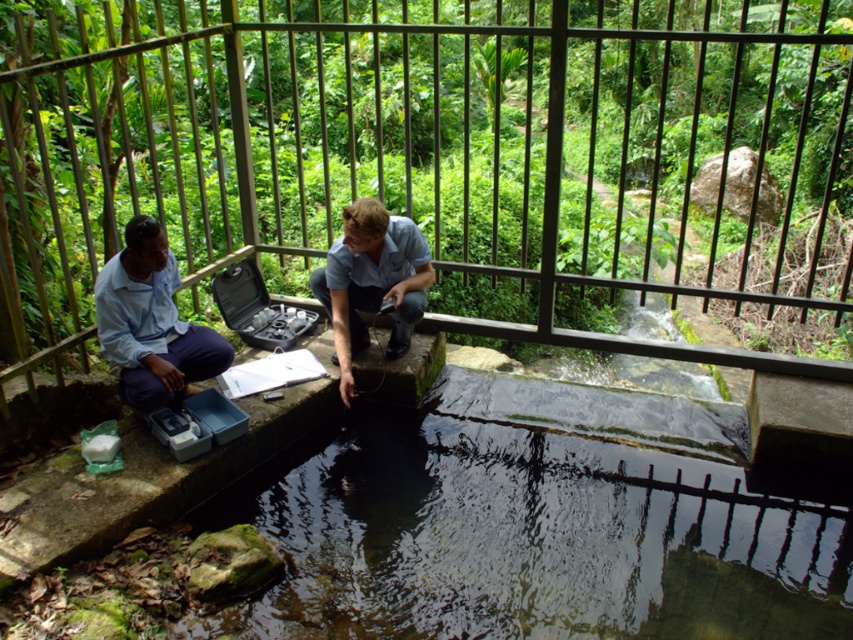
You are a researcher who needs to place a sensor at point (372, 282) in the image. Which object is located at that point?

The blue cotton shirt at center is located at point (372, 282).

You are a safety inspector and need to ensure the distance between the metal at center and the light blue shirt at left is safe. The safety regulation states that the minimum safe distance between any equipment and personnel should be 5 meters. Based on the scene, is the current distance compliant with the regulation?

The metal at center is 5.21 meters from the light blue shirt at left. Since 5.21 meters is greater than the required 5 meters, the current distance is compliant with the safety regulation.